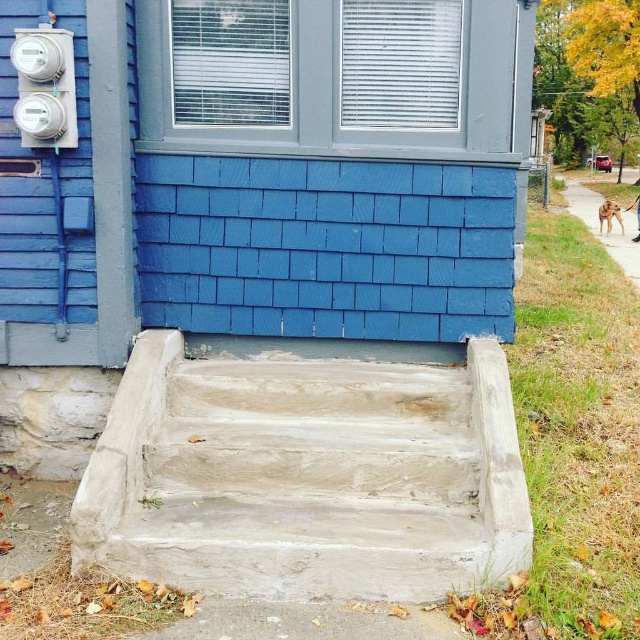
You are a painter who needs to paint both the concrete stairs at center and the blue shingles at center. Based on their heights, which object will require more ladder steps to reach the top?

The concrete stairs at center is much taller than the blue shingles at center, so you will need more ladder steps to reach the top of the concrete stairs at center.

You are standing at the bottom of the concrete steps leading to the blue wall. You see two points marked on the wall. One is at point [417,436] and the other at point [468,188]. Which point is closer to you as you face the wall?

Point [417,436] is in front of point [468,188], so it is closer to you as you face the wall.